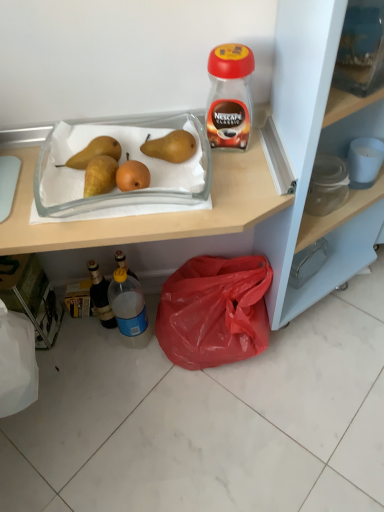
Question: Considering the relative sizes of transparent glass jar at upper right and red plastic bag at lower right in the image provided, is transparent glass jar at upper right smaller than red plastic bag at lower right?

Choices:
 (A) no
 (B) yes

Answer: (B)

Question: From the image's perspective, is transparent glass jar at upper right located beneath red plastic bag at lower right?

Choices:
 (A) yes
 (B) no

Answer: (B)

Question: From a real-world perspective, is transparent glass jar at upper right over red plastic bag at lower right?

Choices:
 (A) no
 (B) yes

Answer: (B)

Question: Can you confirm if transparent glass jar at upper right is positioned to the left of red plastic bag at lower right?

Choices:
 (A) yes
 (B) no

Answer: (B)

Question: Could red plastic bag at lower right be considered to be inside transparent glass jar at upper right?

Choices:
 (A) no
 (B) yes

Answer: (A)

Question: Is the depth of transparent glass jar at upper right less than that of red plastic bag at lower right?

Choices:
 (A) no
 (B) yes

Answer: (B)

Question: Is translucent plastic bottle at lower left, acting as the first bottle starting from the left, aimed at yellow matte pear at upper left, the first pear when ordered from left to right?

Choices:
 (A) no
 (B) yes

Answer: (A)

Question: Is translucent plastic bottle at lower left, the 2th bottle viewed from the right, positioned before yellow matte pear at upper left, the 2th pear from the right?

Choices:
 (A) no
 (B) yes

Answer: (A)

Question: Is there a large distance between translucent plastic bottle at lower left, acting as the first bottle starting from the left, and yellow matte pear at upper left, the first pear when ordered from left to right?

Choices:
 (A) no
 (B) yes

Answer: (A)

Question: Can you confirm if translucent plastic bottle at lower left, the 2th bottle viewed from the right, is positioned to the right of yellow matte pear at upper left, the 2th pear from the right?

Choices:
 (A) no
 (B) yes

Answer: (A)

Question: Does translucent plastic bottle at lower left, the 2th bottle viewed from the right, have a smaller size compared to yellow matte pear at upper left, the 2th pear from the right?

Choices:
 (A) yes
 (B) no

Answer: (B)

Question: From a real-world perspective, is translucent plastic bottle at lower left, the 2th bottle viewed from the right, on yellow matte pear at upper left, the first pear when ordered from left to right?

Choices:
 (A) yes
 (B) no

Answer: (B)

Question: Does clear glass tray at center have a larger size compared to yellow matte pear at upper left, the 2th pear from the right?

Choices:
 (A) yes
 (B) no

Answer: (A)